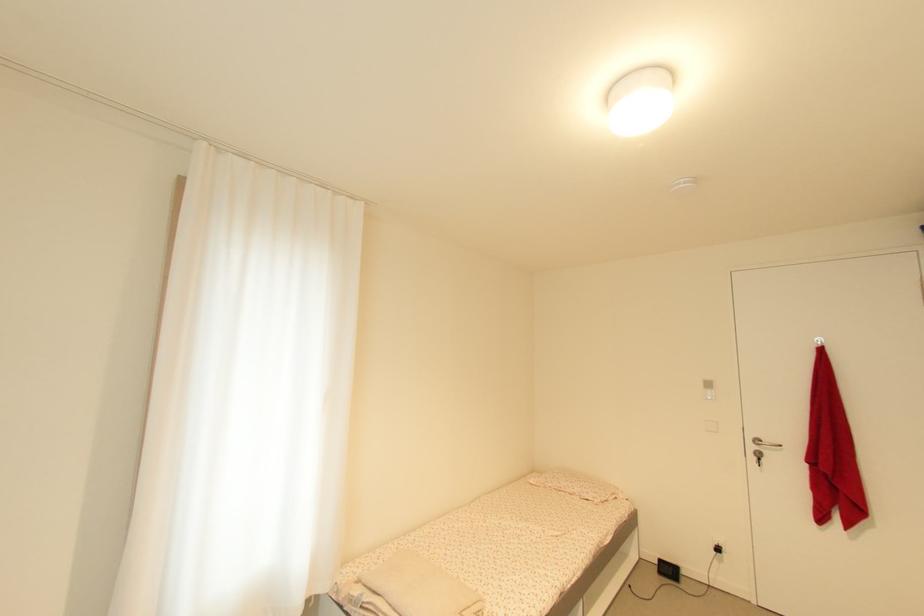
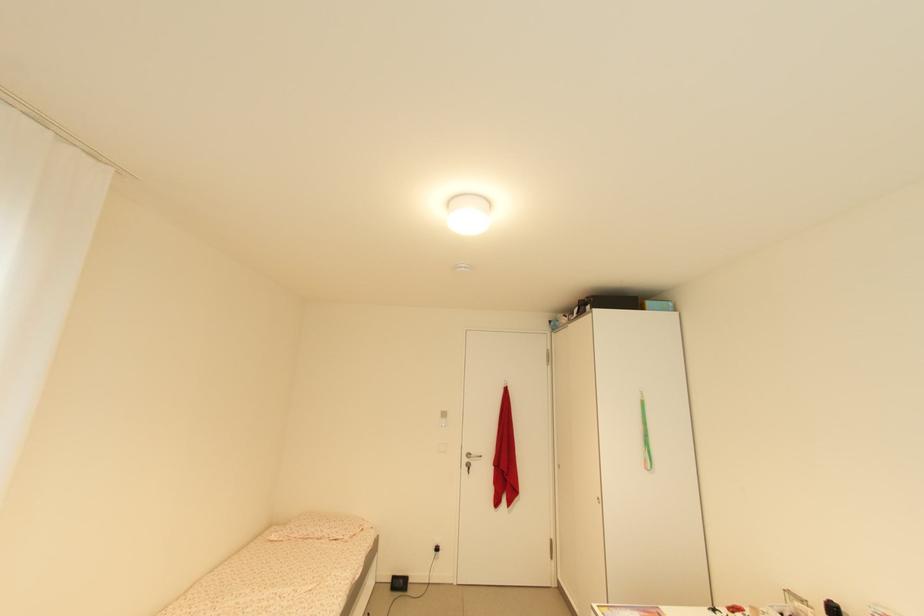
Question: The camera is either moving clockwise (left) or counter-clockwise (right) around the object. The first image is from the beginning of the video and the second image is from the end. Is the camera moving left or right when shooting the video?

Choices:
 (A) Left
 (B) Right

Answer: (A)